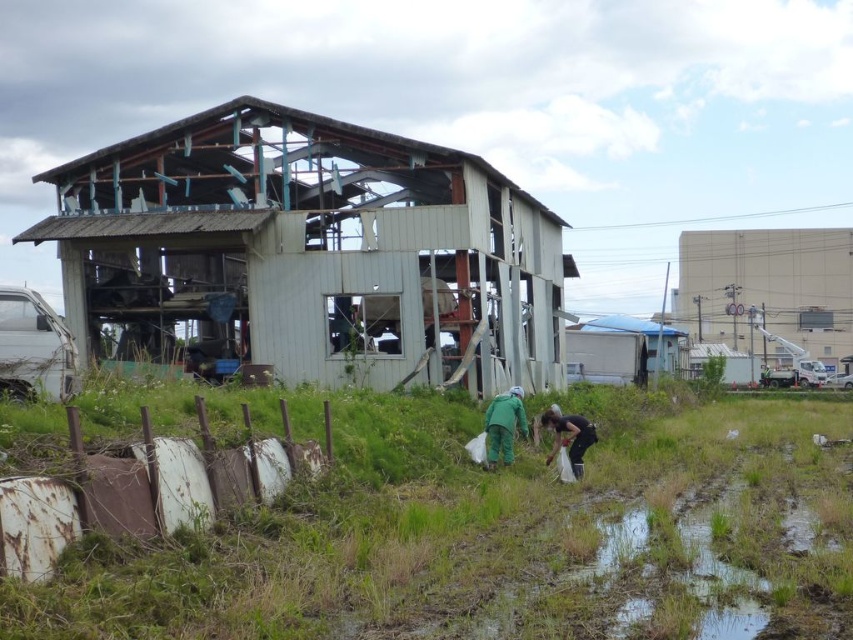
You are a safety inspector assessing the demolition site. You notice the weathered wood hut at center and the blue tarpaulin hut at right. Which structure is closer to your current position?

The weathered wood hut at center is closer to your current position because it is in front of the blue tarpaulin hut at right.